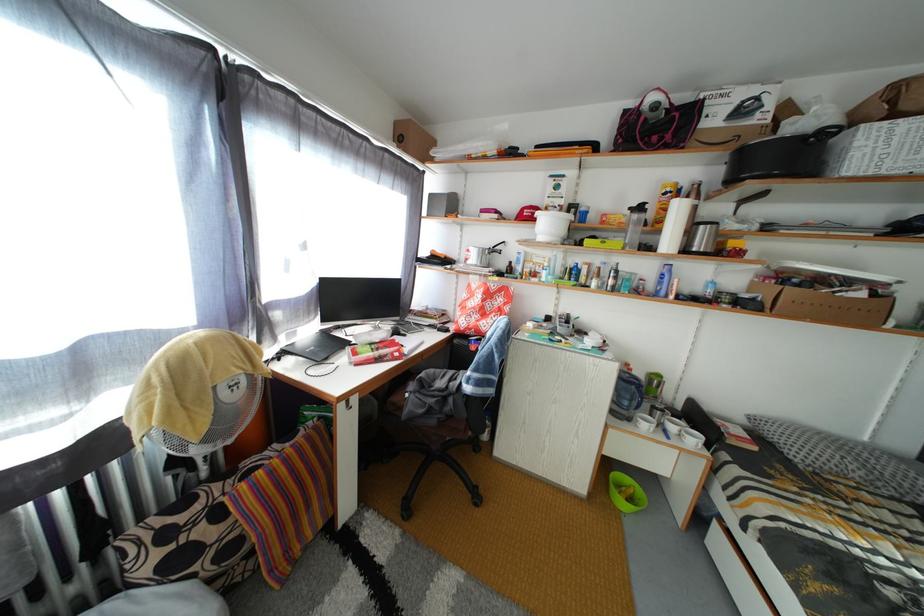
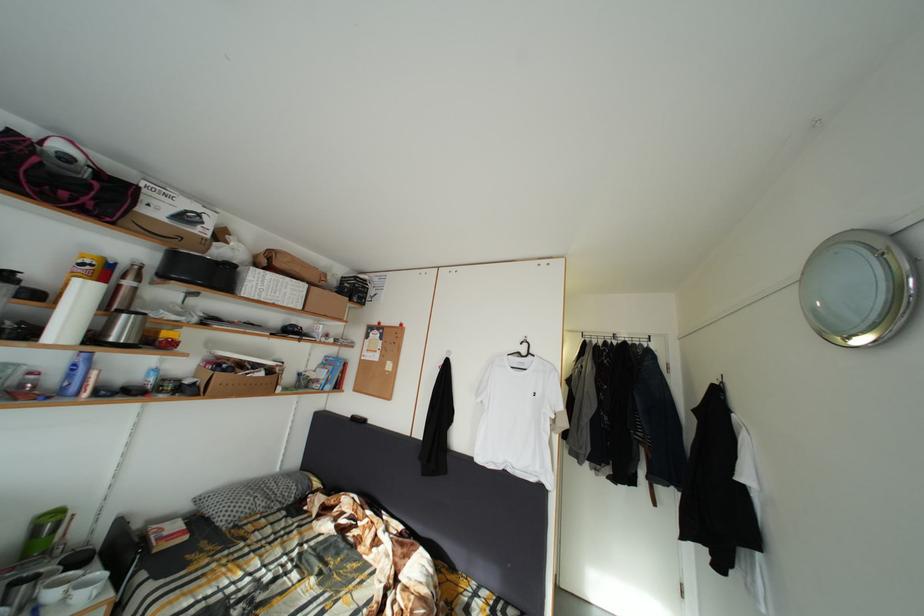
Find the pixel in the second image that matches [666,299] in the first image.

(73, 395)